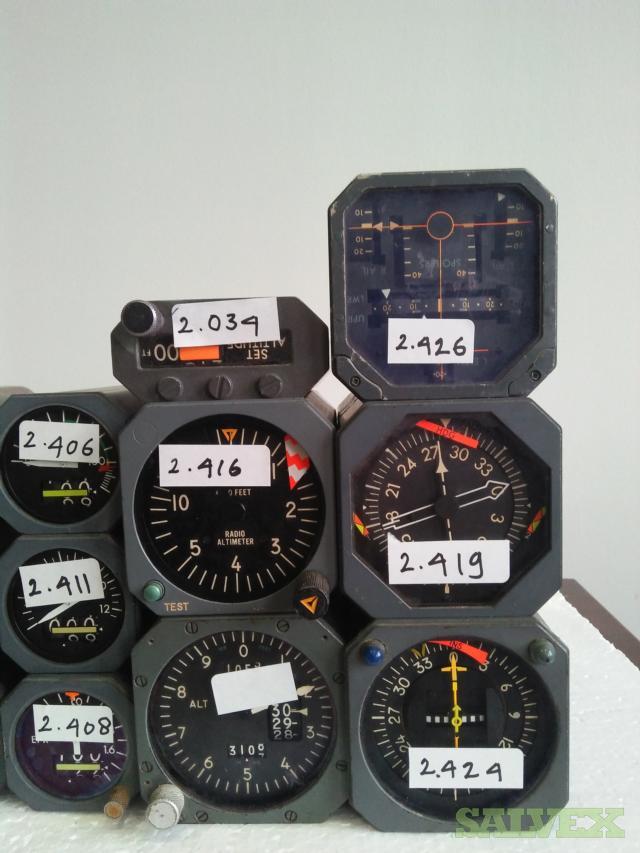
This screenshot has height=853, width=640. What are the coordinates of `brown wood table` in the screenshot? It's located at (607, 617).